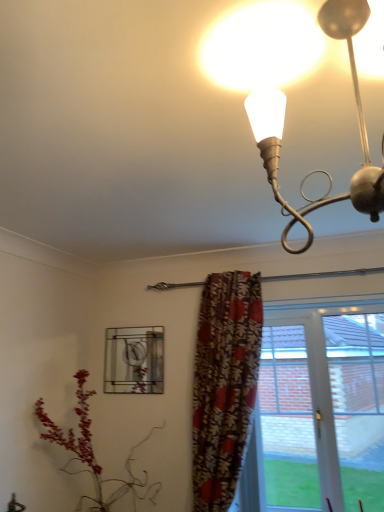
Question: In which direction should I rotate to look at transparent glass door at center, which is counted as the first window, starting from the right?

Choices:
 (A) right
 (B) left

Answer: (A)

Question: Should I look upward or downward to see stained glass window at center, the 2th window from the right?

Choices:
 (A) up
 (B) down

Answer: (B)

Question: From a real-world perspective, is transparent glass door at center, which is counted as the first window, starting from the right, positioned under stained glass window at center, the 1th window viewed from the left, based on gravity?

Choices:
 (A) yes
 (B) no

Answer: (A)

Question: Is transparent glass door at center, which is counted as the first window, starting from the right, behind stained glass window at center, the 1th window viewed from the left?

Choices:
 (A) no
 (B) yes

Answer: (A)

Question: Is transparent glass door at center, which is counted as the first window, starting from the right, positioned far away from stained glass window at center, the 2th window from the right?

Choices:
 (A) yes
 (B) no

Answer: (B)

Question: Could you tell me if transparent glass door at center, the 2th window positioned from the left, is facing stained glass window at center, the 2th window from the right?

Choices:
 (A) no
 (B) yes

Answer: (A)

Question: Is transparent glass door at center, the 2th window positioned from the left, shorter than stained glass window at center, the 1th window viewed from the left?

Choices:
 (A) yes
 (B) no

Answer: (B)

Question: Is transparent glass door at center, which is counted as the first window, starting from the right, smaller than stained glass window at center, the 1th window viewed from the left?

Choices:
 (A) no
 (B) yes

Answer: (A)

Question: Is transparent glass door at center, which is counted as the first window, starting from the right, positioned behind floral fabric curtain at center?

Choices:
 (A) yes
 (B) no

Answer: (A)

Question: Is transparent glass door at center, the 2th window positioned from the left, shorter than floral fabric curtain at center?

Choices:
 (A) yes
 (B) no

Answer: (A)

Question: Does transparent glass door at center, which is counted as the first window, starting from the right, appear on the left side of floral fabric curtain at center?

Choices:
 (A) yes
 (B) no

Answer: (B)

Question: Is transparent glass door at center, which is counted as the first window, starting from the right, closer to the viewer compared to floral fabric curtain at center?

Choices:
 (A) yes
 (B) no

Answer: (B)

Question: Is transparent glass door at center, the 2th window positioned from the left, not close to floral fabric curtain at center?

Choices:
 (A) yes
 (B) no

Answer: (B)

Question: Considering the relative sizes of transparent glass door at center, which is counted as the first window, starting from the right, and floral fabric curtain at center in the image provided, is transparent glass door at center, which is counted as the first window, starting from the right, thinner than floral fabric curtain at center?

Choices:
 (A) no
 (B) yes

Answer: (B)

Question: Considering the relative sizes of floral fabric curtain at center and stained glass window at center, the 2th window from the right, in the image provided, is floral fabric curtain at center bigger than stained glass window at center, the 2th window from the right,?

Choices:
 (A) yes
 (B) no

Answer: (A)